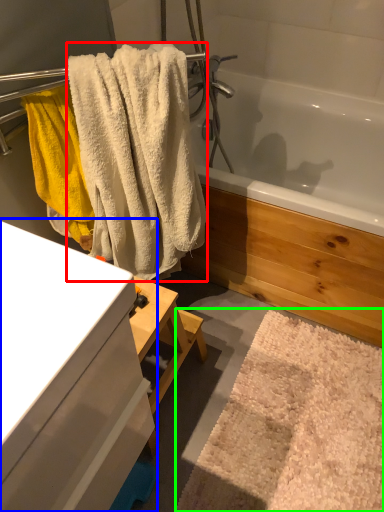
Question: Which object is positioned farthest from towel (highlighted by a red box)? Select from bathroom cabinet (highlighted by a blue box) and bath mat (highlighted by a green box).

Choices:
 (A) bathroom cabinet
 (B) bath mat

Answer: (B)